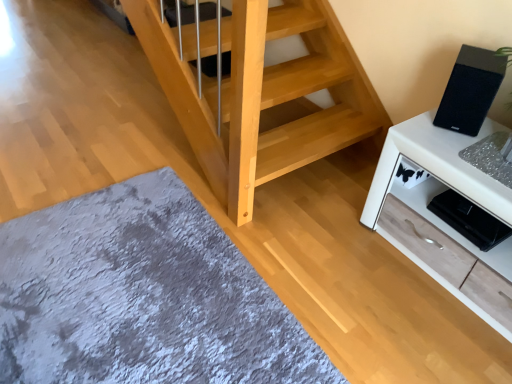
Question: Is gray plush rug at lower left shorter than black matte speaker at upper right?

Choices:
 (A) yes
 (B) no

Answer: (A)

Question: Could you tell me if gray plush rug at lower left is turned towards black matte speaker at upper right?

Choices:
 (A) no
 (B) yes

Answer: (A)

Question: Is gray plush rug at lower left at the right side of black matte speaker at upper right?

Choices:
 (A) no
 (B) yes

Answer: (A)

Question: Is gray plush rug at lower left located outside black matte speaker at upper right?

Choices:
 (A) yes
 (B) no

Answer: (A)

Question: Considering the relative sizes of gray plush rug at lower left and black matte speaker at upper right in the image provided, is gray plush rug at lower left wider than black matte speaker at upper right?

Choices:
 (A) yes
 (B) no

Answer: (A)

Question: Does gray plush rug at lower left appear on the left side of black matte speaker at upper right?

Choices:
 (A) no
 (B) yes

Answer: (B)

Question: Is white wood cabinet at right oriented towards black matte speaker at upper right?

Choices:
 (A) no
 (B) yes

Answer: (A)

Question: Is the depth of white wood cabinet at right greater than that of black matte speaker at upper right?

Choices:
 (A) yes
 (B) no

Answer: (B)

Question: Does white wood cabinet at right have a greater width compared to black matte speaker at upper right?

Choices:
 (A) no
 (B) yes

Answer: (B)

Question: Does white wood cabinet at right appear on the left side of black matte speaker at upper right?

Choices:
 (A) yes
 (B) no

Answer: (B)

Question: Can you confirm if white wood cabinet at right is bigger than black matte speaker at upper right?

Choices:
 (A) yes
 (B) no

Answer: (A)

Question: Does white wood cabinet at right have a lesser width compared to black matte speaker at upper right?

Choices:
 (A) no
 (B) yes

Answer: (A)

Question: Considering the relative sizes of black matte speaker at upper right and gray plush rug at lower left in the image provided, is black matte speaker at upper right bigger than gray plush rug at lower left?

Choices:
 (A) yes
 (B) no

Answer: (B)